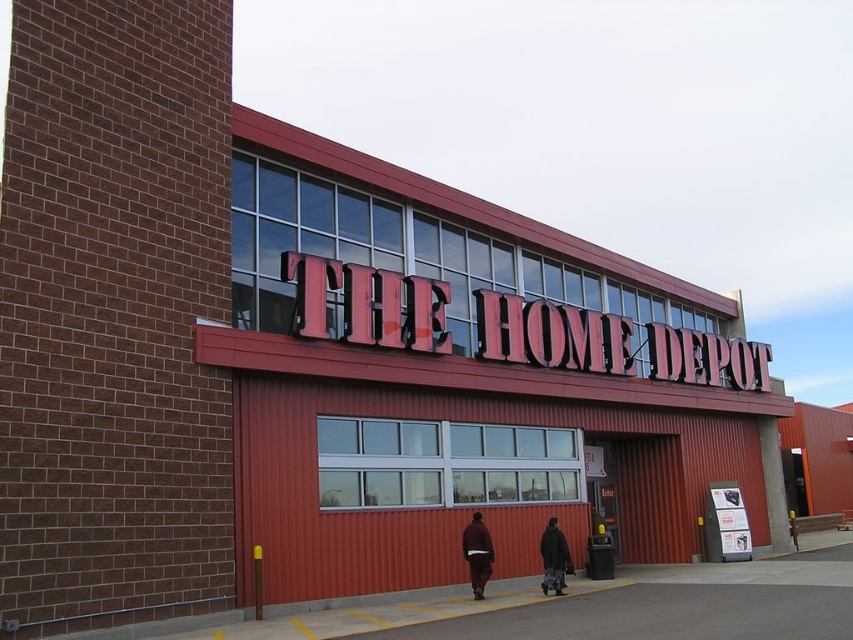
Question: Considering the relative positions of brown wool sweater at center and dark brown textured coat at center in the image provided, where is brown wool sweater at center located with respect to dark brown textured coat at center?

Choices:
 (A) right
 (B) left

Answer: (B)

Question: Does brown wool sweater at center come in front of dark brown textured coat at center?

Choices:
 (A) yes
 (B) no

Answer: (A)

Question: Which point is closer to the camera taking this photo?

Choices:
 (A) (540, 548)
 (B) (486, 547)

Answer: (B)

Question: Does brown wool sweater at center lie in front of dark brown textured coat at center?

Choices:
 (A) no
 (B) yes

Answer: (B)